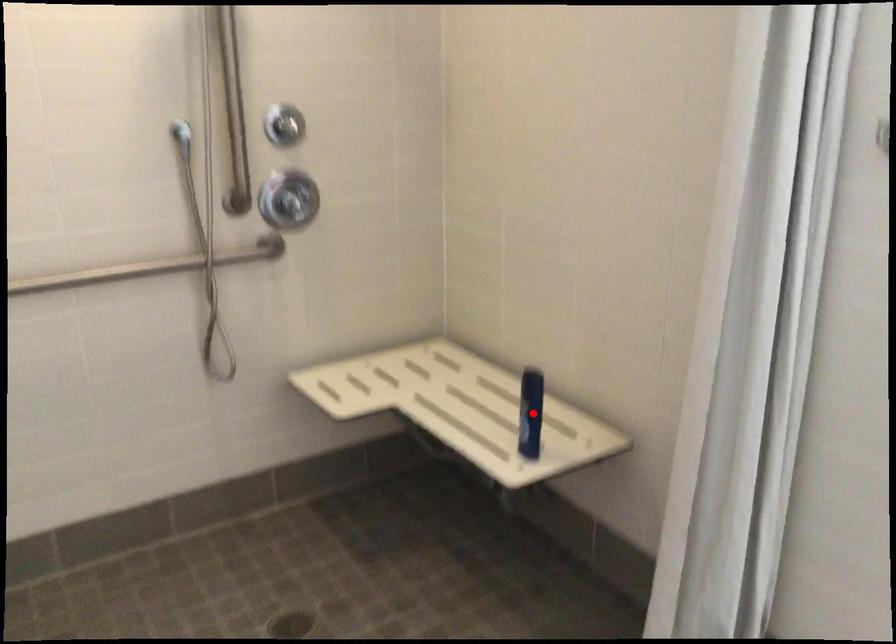
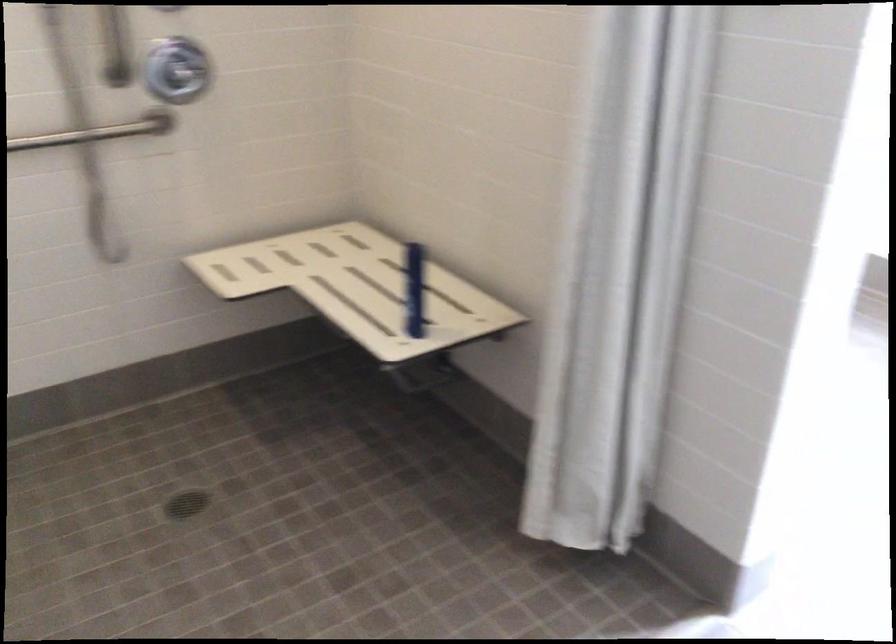
In the second image, find the point that corresponds to the highlighted location in the first image.

(414, 289)